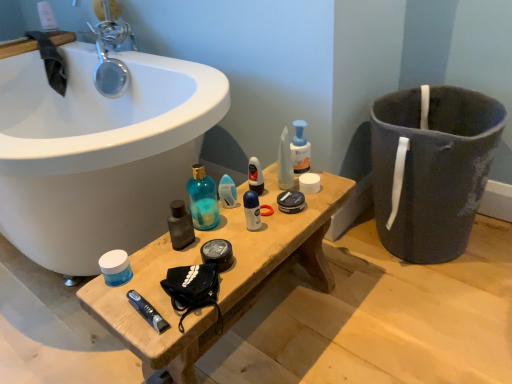
What do you see at coordinates (255, 176) in the screenshot? I see `shiny plastic mouthwash at center, which is the 2th mouthwash in top-to-bottom order` at bounding box center [255, 176].

You are a GUI agent. You are given a task and a screenshot of the screen. Output one action in this format:
    pyautogui.click(x=<x>, y=<y>)
    Task: Click on the translucent plastic bottle at center, arranged as the 1th mouthwash when viewed from the right
    
    Given the screenshot: What is the action you would take?
    pyautogui.click(x=300, y=149)

The width and height of the screenshot is (512, 384). Describe the element at coordinates (285, 162) in the screenshot. I see `translucent plastic soap dispenser at center, marked as the 3th toiletry in a left-to-right arrangement` at that location.

Where is `shiny plastic mouthwash at center, acting as the second mouthwash starting from the front`? The height and width of the screenshot is (384, 512). shiny plastic mouthwash at center, acting as the second mouthwash starting from the front is located at coordinates (255, 176).

Can you confirm if shiny plastic mouthwash at center, which ranks as the second mouthwash in bottom-to-top order, is thinner than blue matte jar at center, placed as the third mouthwash when sorted from top to bottom?

Indeed, shiny plastic mouthwash at center, which ranks as the second mouthwash in bottom-to-top order, has a lesser width compared to blue matte jar at center, placed as the third mouthwash when sorted from top to bottom.

Considering the relative positions of shiny plastic mouthwash at center, which is the 2th mouthwash from right to left, and blue matte jar at center, the first mouthwash in the left-to-right sequence, in the image provided, is shiny plastic mouthwash at center, which is the 2th mouthwash from right to left, to the right of blue matte jar at center, the first mouthwash in the left-to-right sequence, from the viewer's perspective?

Correct, you'll find shiny plastic mouthwash at center, which is the 2th mouthwash from right to left, to the right of blue matte jar at center, the first mouthwash in the left-to-right sequence.

Is shiny plastic mouthwash at center, which is the 2th mouthwash from right to left, shorter than blue matte jar at center, the 1th mouthwash from the bottom?

In fact, shiny plastic mouthwash at center, which is the 2th mouthwash from right to left, may be taller than blue matte jar at center, the 1th mouthwash from the bottom.

Is the surface of shiny plastic mouthwash at center, which ranks as the second mouthwash in left-to-right order, in direct contact with blue matte jar at center, the 1th mouthwash from the bottom?

No, shiny plastic mouthwash at center, which ranks as the second mouthwash in left-to-right order, is not making contact with blue matte jar at center, the 1th mouthwash from the bottom.

Is blue matte jar at center, placed as the third mouthwash when sorted from top to bottom, placed right next to shiny plastic mouthwash at center, which is the 2th mouthwash from right to left?

No, blue matte jar at center, placed as the third mouthwash when sorted from top to bottom, is not in contact with shiny plastic mouthwash at center, which is the 2th mouthwash from right to left.

Which is more to the right, blue matte jar at center, placed as the third mouthwash when sorted from top to bottom, or shiny plastic mouthwash at center, which is the 2th mouthwash in top-to-bottom order?

From the viewer's perspective, shiny plastic mouthwash at center, which is the 2th mouthwash in top-to-bottom order, appears more on the right side.

From a real-world perspective, which object stands above the other?

shiny plastic mouthwash at center, which ranks as the second mouthwash in left-to-right order.

Find the location of a particular element. Image resolution: width=512 pixels, height=384 pixels. mouthwash on the left of the shiny plastic mouthwash at center, which is the 2th mouthwash in top-to-bottom order is located at coordinates (115, 267).

Is the surface of wooden bench at center in direct contact with translucent plastic soap dispenser at center, marked as the 3th toiletry in a left-to-right arrangement?

They are not placed beside each other.

What's the angular difference between wooden bench at center and translucent plastic soap dispenser at center, marked as the 3th toiletry in a left-to-right arrangement,'s facing directions?

The angular difference between wooden bench at center and translucent plastic soap dispenser at center, marked as the 3th toiletry in a left-to-right arrangement, is 65.2 degrees.

From a real-world perspective, who is located higher, wooden bench at center or translucent plastic soap dispenser at center, positioned as the 1th toiletry in right-to-left order?

translucent plastic soap dispenser at center, positioned as the 1th toiletry in right-to-left order.

Is wooden bench at center wider or thinner than translucent plastic soap dispenser at center, marked as the 3th toiletry in a left-to-right arrangement?

wooden bench at center is wider than translucent plastic soap dispenser at center, marked as the 3th toiletry in a left-to-right arrangement.

From the image's perspective, does blue matte jar at center, the 1th mouthwash from the bottom, appear lower than blue matte toothpaste at center?

No, from the image's perspective, blue matte jar at center, the 1th mouthwash from the bottom, is not below blue matte toothpaste at center.

Is blue matte jar at center, the first mouthwash in the left-to-right sequence, aimed at blue matte toothpaste at center?

No, blue matte jar at center, the first mouthwash in the left-to-right sequence, is not turned towards blue matte toothpaste at center.

Which is behind, point (105, 269) or point (145, 314)?

The point (105, 269) is farther from the camera.

Locate an element on the screen. The width and height of the screenshot is (512, 384). the 1st mouthwash positioned above the blue matte toothpaste at center (from the image's perspective) is located at coordinates (115, 267).

Does dark gray fabric trash bin/can at right have a larger size compared to shiny plastic mouthwash at center, which is the 2th mouthwash in top-to-bottom order?

Correct, dark gray fabric trash bin/can at right is larger in size than shiny plastic mouthwash at center, which is the 2th mouthwash in top-to-bottom order.

From the image's perspective, which one is positioned lower, dark gray fabric trash bin/can at right or shiny plastic mouthwash at center, which is the 2th mouthwash from right to left?

From the image's view, dark gray fabric trash bin/can at right is below.

Would you say dark gray fabric trash bin/can at right is to the left or to the right of shiny plastic mouthwash at center, which appears as the 2th mouthwash when viewed from the back, in the picture?

Based on their positions, dark gray fabric trash bin/can at right is located to the right of shiny plastic mouthwash at center, which appears as the 2th mouthwash when viewed from the back.

Is dark gray fabric trash bin/can at right oriented towards shiny plastic mouthwash at center, which is the 2th mouthwash in top-to-bottom order?

Yes, dark gray fabric trash bin/can at right is facing shiny plastic mouthwash at center, which is the 2th mouthwash in top-to-bottom order.

From the image's perspective, who appears lower, blue matte toothpaste at center or blue matte jar at center, which is the 1th mouthwash in front-to-back order?

blue matte toothpaste at center is shown below in the image.

From a real-world perspective, who is located lower, blue matte toothpaste at center or blue matte jar at center, the first mouthwash in the left-to-right sequence?

blue matte toothpaste at center, from a real-world perspective.

Is blue matte toothpaste at center not within blue matte jar at center, the first mouthwash in the left-to-right sequence?

Yes.

Can you see shiny plastic mouthwash at center, which is the 2th mouthwash in top-to-bottom order, touching wooden bench at center?

No, shiny plastic mouthwash at center, which is the 2th mouthwash in top-to-bottom order, is not in contact with wooden bench at center.

From the image's perspective, is shiny plastic mouthwash at center, which is the 2th mouthwash from right to left, under wooden bench at center?

No.

Considering the relative positions of shiny plastic mouthwash at center, which appears as the 2th mouthwash when viewed from the back, and wooden bench at center in the image provided, is shiny plastic mouthwash at center, which appears as the 2th mouthwash when viewed from the back, to the right of wooden bench at center from the viewer's perspective?

Correct, you'll find shiny plastic mouthwash at center, which appears as the 2th mouthwash when viewed from the back, to the right of wooden bench at center.

Considering the sizes of objects shiny plastic mouthwash at center, which ranks as the second mouthwash in bottom-to-top order, and wooden bench at center in the image provided, who is taller, shiny plastic mouthwash at center, which ranks as the second mouthwash in bottom-to-top order, or wooden bench at center?

With more height is wooden bench at center.

Locate an element on the screen. the 1st mouthwash above the blue matte jar at center, the 3th mouthwash in the right-to-left sequence (from the image's perspective) is located at coordinates (255, 176).

You are a GUI agent. You are given a task and a screenshot of the screen. Output one action in this format:
    pyautogui.click(x=<x>, y=<y>)
    Task: Click on the mouthwash that is the 1st object located behind the blue matte jar at center, positioned as the 3th mouthwash in back-to-front order
    This screenshot has height=384, width=512.
    Given the screenshot: What is the action you would take?
    pyautogui.click(x=255, y=176)

Which object lies further to the anchor point dark gray fabric trash bin/can at right, translucent plastic bottle at center, acting as the 3th mouthwash starting from the left, or shiny plastic mouthwash at center, which is the 2th mouthwash in top-to-bottom order?

shiny plastic mouthwash at center, which is the 2th mouthwash in top-to-bottom order, lies further to dark gray fabric trash bin/can at right than the other object.

When comparing their distances from translucent plastic soap dispenser at center, positioned as the 1th toiletry in right-to-left order, does wooden bench at center or white matte deodorant at center, arranged as the 2th toiletry when viewed from the left, seem further?

Among the two, wooden bench at center is located further to translucent plastic soap dispenser at center, positioned as the 1th toiletry in right-to-left order.

From the picture: Estimate the real-world distances between objects in this image. Which object is further from blue matte toothpaste at center, translucent plastic soap dispenser at center, positioned as the 1th toiletry in right-to-left order, or translucent plastic deodorant at center, the 3th toiletry positioned from the right?

translucent plastic soap dispenser at center, positioned as the 1th toiletry in right-to-left order, is positioned further to the anchor blue matte toothpaste at center.

Estimate the real-world distances between objects in this image. Which object is further from translucent plastic soap dispenser at center, marked as the 3th toiletry in a left-to-right arrangement, wooden bench at center or blue matte jar at center, the 3th mouthwash in the right-to-left sequence?

blue matte jar at center, the 3th mouthwash in the right-to-left sequence, is further to translucent plastic soap dispenser at center, marked as the 3th toiletry in a left-to-right arrangement.

Consider the image. Considering their positions, is translucent plastic deodorant at center, the 3th toiletry positioned from the right, positioned closer to translucent plastic bottle at center, arranged as the 3th mouthwash when viewed from the front, than dark gray fabric trash bin/can at right?

The object closer to translucent plastic bottle at center, arranged as the 3th mouthwash when viewed from the front, is translucent plastic deodorant at center, the 3th toiletry positioned from the right.

Looking at the image, which one is located further to translucent plastic soap dispenser at center, positioned as the 1th toiletry in right-to-left order, translucent plastic bottle at center, arranged as the 3th mouthwash when viewed from the front, or wooden bench at center?

wooden bench at center is further to translucent plastic soap dispenser at center, positioned as the 1th toiletry in right-to-left order.

Based on their spatial positions, is translucent plastic bottle at center, arranged as the 1th mouthwash when viewed from the right, or blue matte jar at center, which is the 1th mouthwash in front-to-back order, closer to shiny plastic mouthwash at center, which is the 2th mouthwash from right to left?

translucent plastic bottle at center, arranged as the 1th mouthwash when viewed from the right.

Which object lies further to the anchor point translucent plastic bottle at center, arranged as the 3th mouthwash when viewed from the front, blue matte jar at center, positioned as the 3th mouthwash in back-to-front order, or shiny plastic mouthwash at center, which is the 2th mouthwash from right to left?

The object further to translucent plastic bottle at center, arranged as the 3th mouthwash when viewed from the front, is blue matte jar at center, positioned as the 3th mouthwash in back-to-front order.

This screenshot has height=384, width=512. Find the location of `furniture situated between blue matte jar at center, the first mouthwash in the left-to-right sequence, and dark gray fabric trash bin/can at right from left to right`. furniture situated between blue matte jar at center, the first mouthwash in the left-to-right sequence, and dark gray fabric trash bin/can at right from left to right is located at coordinates (220, 281).

The width and height of the screenshot is (512, 384). Identify the location of toothpaste positioned between wooden bench at center and white matte deodorant at center, arranged as the 2th toiletry when viewed from the left, from near to far. (147, 311).

The image size is (512, 384). What are the coordinates of `toothpaste positioned between wooden bench at center and translucent plastic deodorant at center, the 1th toiletry positioned from the left, from near to far` in the screenshot? It's located at (147, 311).

Image resolution: width=512 pixels, height=384 pixels. I want to click on mouthwash between translucent plastic deodorant at center, the 1th toiletry positioned from the left, and translucent plastic soap dispenser at center, positioned as the 1th toiletry in right-to-left order, from left to right, so click(255, 176).